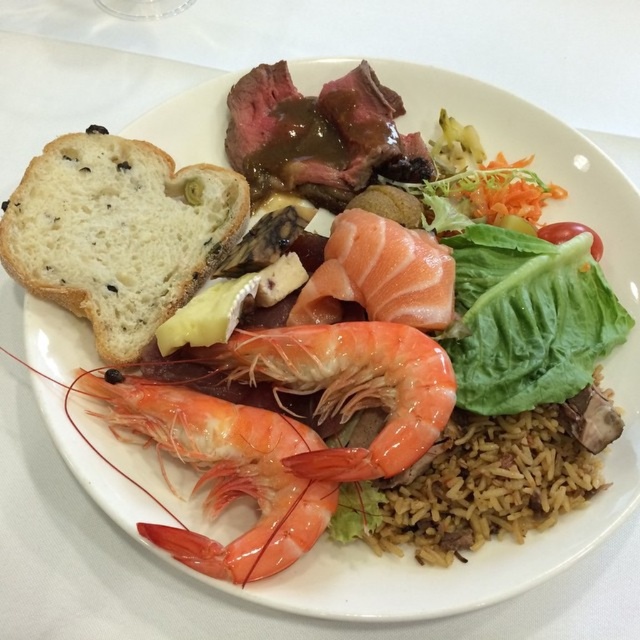
Consider the image. Where is the white soft bread at left located in the image?

The white soft bread at left is located at point (x=118, y=234) in the image.

You are a food stylist arranging a plate. You have the white soft bread at left and the green leafy lettuce at center. Which item is taller?

The white soft bread at left is taller than the green leafy lettuce at center.

You are a food critic evaluating the presentation of this dish. The plate has a white circular plate. You need to determine if the brown rice at center is wider than the pink smooth salmon at center. Based on the description, what is your observation?

The brown rice at center is wider than the pink smooth salmon at center as stated in the objects description.